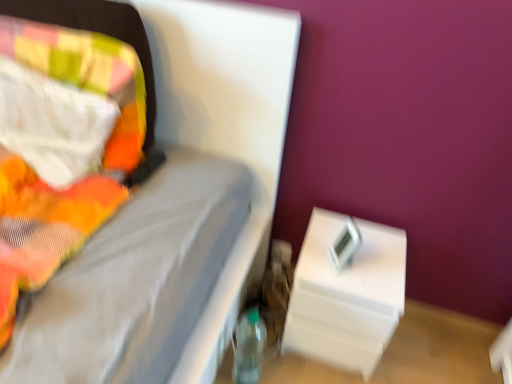
Measure the distance between point (248, 373) and camera.

Point (248, 373) and camera are 4.53 feet apart.

At what (x,y) coordinates should I click in order to perform the action: click on white plastic nightstand at lower right. Please return your answer as a coordinate pair (x, y). Looking at the image, I should click on (346, 292).

Considering the points (84, 153) and (371, 303), which point is in front, point (84, 153) or point (371, 303)?

Point (84, 153)

From a real-world perspective, does fluffy multicolored pillow at left stand above white plastic nightstand at lower right?

Yes, from a real-world perspective, fluffy multicolored pillow at left is over white plastic nightstand at lower right

Considering the relative sizes of transparent plastic bottle at lower center and fluffy multicolored pillow at left in the image provided, is transparent plastic bottle at lower center smaller than fluffy multicolored pillow at left?

Yes, transparent plastic bottle at lower center is smaller than fluffy multicolored pillow at left.

From the picture: How different are the orientations of transparent plastic bottle at lower center and fluffy multicolored pillow at left in degrees?

transparent plastic bottle at lower center and fluffy multicolored pillow at left are facing 20.3 degrees away from each other.

From a real-world perspective, relative to fluffy multicolored pillow at left, is transparent plastic bottle at lower center vertically above or below?

transparent plastic bottle at lower center is situated lower than fluffy multicolored pillow at left in the real world.

Is transparent plastic bottle at lower center oriented towards fluffy multicolored pillow at left?

No, transparent plastic bottle at lower center is not turned towards fluffy multicolored pillow at left.

Is transparent plastic bottle at lower center not inside white plastic nightstand at lower right?

Indeed, transparent plastic bottle at lower center is completely outside white plastic nightstand at lower right.

Considering the sizes of transparent plastic bottle at lower center and white plastic nightstand at lower right in the image, is transparent plastic bottle at lower center taller or shorter than white plastic nightstand at lower right?

In the image, transparent plastic bottle at lower center appears to be shorter than white plastic nightstand at lower right.

Does transparent plastic bottle at lower center turn towards white plastic nightstand at lower right?

No, transparent plastic bottle at lower center is not aimed at white plastic nightstand at lower right.

Can you confirm if transparent plastic bottle at lower center is positioned to the right of white plastic nightstand at lower right?

No.

Would you say white plastic nightstand at lower right is outside transparent plastic bottle at lower center?

Indeed, white plastic nightstand at lower right is completely outside transparent plastic bottle at lower center.

From the image's perspective, between white plastic nightstand at lower right and transparent plastic bottle at lower center, which one is located above?

white plastic nightstand at lower right, from the image's perspective.

What's the angular difference between white plastic nightstand at lower right and transparent plastic bottle at lower center's facing directions?

The angular difference between white plastic nightstand at lower right and transparent plastic bottle at lower center is 18 degrees.

In the image, is white plastic nightstand at lower right positioned in front of or behind transparent plastic bottle at lower center?

Visually, white plastic nightstand at lower right is located behind transparent plastic bottle at lower center.

From a real-world perspective, is fluffy multicolored pillow at left positioned under transparent plastic bottle at lower center based on gravity?

No, from a real-world perspective, fluffy multicolored pillow at left is not beneath transparent plastic bottle at lower center.

Does fluffy multicolored pillow at left have a lesser width compared to transparent plastic bottle at lower center?

No, fluffy multicolored pillow at left is not thinner than transparent plastic bottle at lower center.

Is fluffy multicolored pillow at left aimed at transparent plastic bottle at lower center?

No, fluffy multicolored pillow at left does not turn towards transparent plastic bottle at lower center.

Which of these two, fluffy multicolored pillow at left or transparent plastic bottle at lower center, is smaller?

Smaller between the two is transparent plastic bottle at lower center.

Which object is further away from the camera taking this photo, white plastic nightstand at lower right or fluffy multicolored pillow at left?

Positioned behind is white plastic nightstand at lower right.

Which object is positioned more to the right, white plastic nightstand at lower right or fluffy multicolored pillow at left?

white plastic nightstand at lower right is more to the right.

In the image, there is a fluffy multicolored pillow at left. In order to click on nightstand below it (from the image's perspective) in this screenshot , I will do `click(346, 292)`.

You are a GUI agent. You are given a task and a screenshot of the screen. Output one action in this format:
    pyautogui.click(x=<x>, y=<y>)
    Task: Click on the pillow lying on the left of transparent plastic bottle at lower center
    This screenshot has height=384, width=512.
    Given the screenshot: What is the action you would take?
    pyautogui.click(x=53, y=124)

Estimate the real-world distances between objects in this image. Which object is closer to fluffy multicolored pillow at left, transparent plastic bottle at lower center or white plastic nightstand at lower right?

Among the two, transparent plastic bottle at lower center is located nearer to fluffy multicolored pillow at left.

Which object lies nearer to the anchor point transparent plastic bottle at lower center, fluffy multicolored pillow at left or white plastic nightstand at lower right?

white plastic nightstand at lower right is positioned closer to the anchor transparent plastic bottle at lower center.

Which object lies further to the anchor point transparent plastic bottle at lower center, white plastic nightstand at lower right or fluffy multicolored pillow at left?

The object further to transparent plastic bottle at lower center is fluffy multicolored pillow at left.

Consider the image. Estimate the real-world distances between objects in this image. Which object is closer to white plastic nightstand at lower right, fluffy multicolored pillow at left or transparent plastic bottle at lower center?

The object closer to white plastic nightstand at lower right is transparent plastic bottle at lower center.

When comparing their distances from fluffy multicolored pillow at left, does white plastic nightstand at lower right or transparent plastic bottle at lower center seem closer?

transparent plastic bottle at lower center is closer to fluffy multicolored pillow at left.

When comparing their distances from white plastic nightstand at lower right, does transparent plastic bottle at lower center or fluffy multicolored pillow at left seem closer?

transparent plastic bottle at lower center is closer to white plastic nightstand at lower right.

Find the location of a particular element. This screenshot has width=512, height=384. bottle between fluffy multicolored pillow at left and white plastic nightstand at lower right in the horizontal direction is located at coordinates (249, 347).